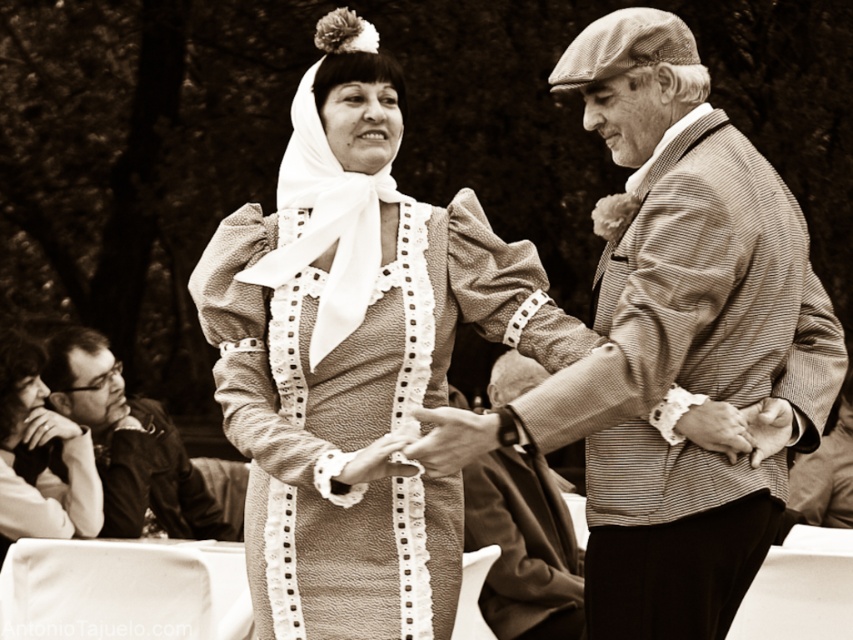
You are a tailor who needs to determine which jacket requires more fabric to make between the striped woolen jacket at center and the matte black jacket at lower left. Based on the image, which one would need more fabric?

The striped woolen jacket at center is larger in size than the matte black jacket at lower left, so it would require more fabric to make.

You are standing in front of the vintage photograph and notice the striped woolen jacket at center. Can you determine its exact position using the coordinate system provided?

The striped woolen jacket at center is located at point (682, 340) according to the coordinate system provided.

You are a photographer reviewing this vintage image. You notice the matte black jacket at lower left and the smooth leather hand at center. Which object is positioned further to the left in the image?

The matte black jacket at lower left is positioned further to the left than the smooth leather hand at center.